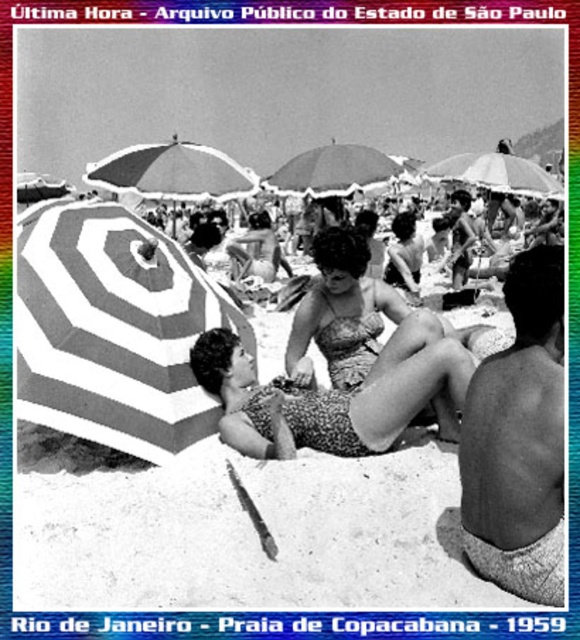
You are standing at the edge of the beach and want to walk towards the two specific points marked in the image. Which point, point (319, 417) or point (319, 189), would require you to walk a shorter distance?

Point (319, 417) is closer to the viewer than point (319, 189), so you would need to walk a shorter distance to reach point (319, 417).

You are a photographer at Praia de Copacabana in 1959. You want to capture a photo of the white striped umbrella at left without including the two women seated on the sand. Is the umbrella positioned in a way that allows this?

The white striped umbrella at left is located at point (242, 531). Since the two women are seated in the foreground, it is possible to frame the photo so that the umbrella is visible while excluding the women by adjusting the camera angle or zoom.